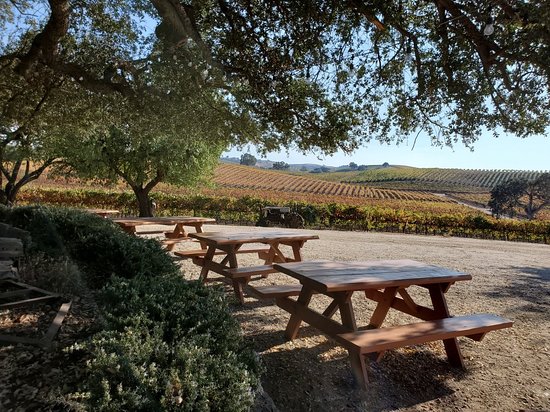
Find the location of a particular element. The height and width of the screenshot is (412, 550). benches is located at coordinates (412, 333), (270, 291), (258, 268), (194, 251), (169, 239).